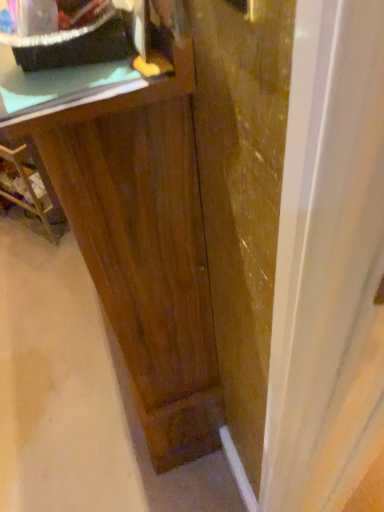
Question: Considering the relative sizes of green matte counter top at upper left and dark wood vanity at center in the image provided, is green matte counter top at upper left shorter than dark wood vanity at center?

Choices:
 (A) yes
 (B) no

Answer: (A)

Question: Is green matte counter top at upper left positioned behind dark wood vanity at center?

Choices:
 (A) yes
 (B) no

Answer: (A)

Question: From a real-world perspective, is green matte counter top at upper left under dark wood vanity at center?

Choices:
 (A) yes
 (B) no

Answer: (B)

Question: Can you confirm if green matte counter top at upper left is thinner than dark wood vanity at center?

Choices:
 (A) yes
 (B) no

Answer: (A)

Question: Does green matte counter top at upper left have a greater width compared to dark wood vanity at center?

Choices:
 (A) yes
 (B) no

Answer: (B)

Question: In terms of height, does matte black tray at upper left look taller or shorter compared to green matte counter top at upper left?

Choices:
 (A) short
 (B) tall

Answer: (B)

Question: In terms of size, does matte black tray at upper left appear bigger or smaller than green matte counter top at upper left?

Choices:
 (A) small
 (B) big

Answer: (B)

Question: From the image's perspective, relative to green matte counter top at upper left, is matte black tray at upper left above or below?

Choices:
 (A) below
 (B) above

Answer: (B)

Question: Is matte black tray at upper left spatially inside green matte counter top at upper left, or outside of it?

Choices:
 (A) outside
 (B) inside

Answer: (A)

Question: Is green matte counter top at upper left situated inside transparent glass door at center or outside?

Choices:
 (A) outside
 (B) inside

Answer: (A)

Question: In the image, is green matte counter top at upper left positioned in front of or behind transparent glass door at center?

Choices:
 (A) front
 (B) behind

Answer: (B)

Question: Looking at their shapes, would you say green matte counter top at upper left is wider or thinner than transparent glass door at center?

Choices:
 (A) wide
 (B) thin

Answer: (A)

Question: Would you say green matte counter top at upper left is to the left or to the right of transparent glass door at center in the picture?

Choices:
 (A) left
 (B) right

Answer: (A)

Question: In the image, is transparent glass door at center positioned in front of or behind dark wood cabinet at left?

Choices:
 (A) front
 (B) behind

Answer: (A)

Question: In terms of width, does transparent glass door at center look wider or thinner when compared to dark wood cabinet at left?

Choices:
 (A) thin
 (B) wide

Answer: (A)